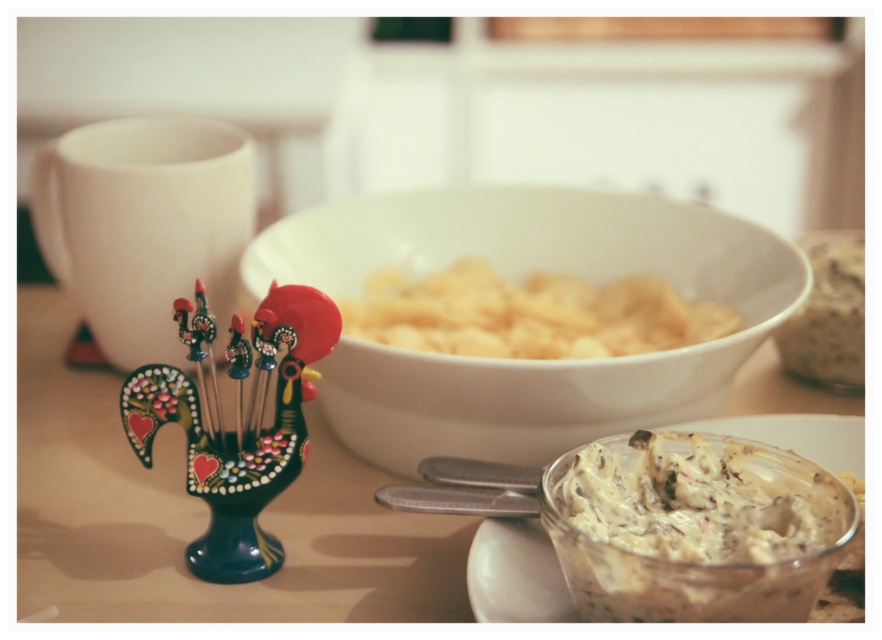
You are sitting at the dining table and notice two points marked on the table. The first point is at coordinate point (x=551, y=483) and the second is at point (x=830, y=312). If you were to reach out to touch both points, which point would your hand encounter first?

Point (x=551, y=483) is in front of point (x=830, y=312), so your hand would encounter point (x=551, y=483) first.

You are a guest at a dinner party and want to reach for the white creamy dip at center and the smooth brown bread at right. Which item is shorter in height?

The white creamy dip at center is shorter than the smooth brown bread at right.

You are a guest at a dinner party and want to reach for a chip from the white matte chips at center and a piece of bread from the smooth brown bread at right. Which item is closer to your right hand if you are sitting at the table?

The smooth brown bread at right is closer to your right hand because it is positioned to the right of the white matte chips at center.